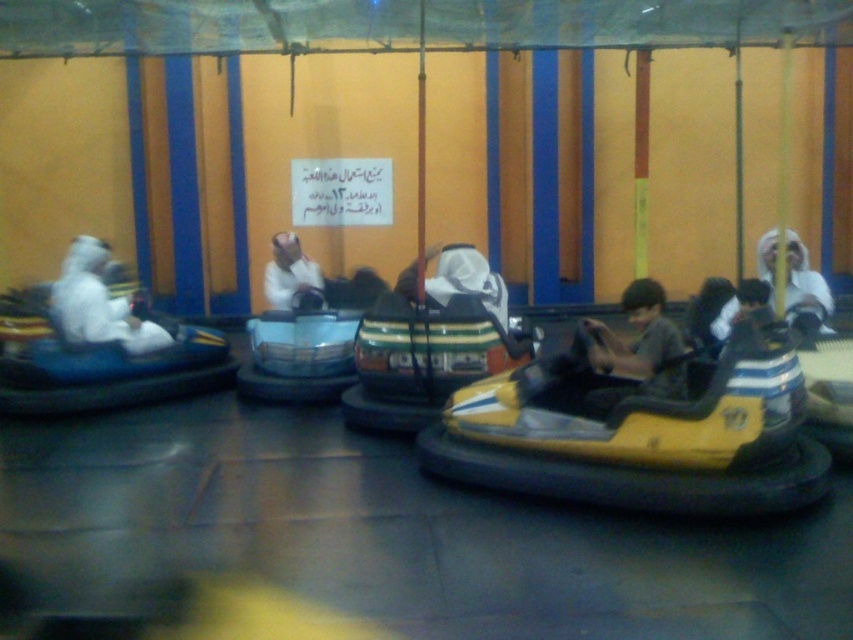
Based on the photo, you are standing at point [287,289] and want to move towards the bumper car ride entrance located at point [775,250]. Is the entrance in front of you or behind you?

The entrance at point [775,250] is in front of you because it is positioned in front of your current location at point [287,289].

You are standing at the entrance of the bumper car ride area. There is a point marked at coordinates (640,432). Which bumper car is this point located on?

The point at coordinates (640,432) is located on the yellow matte bumper car at center.